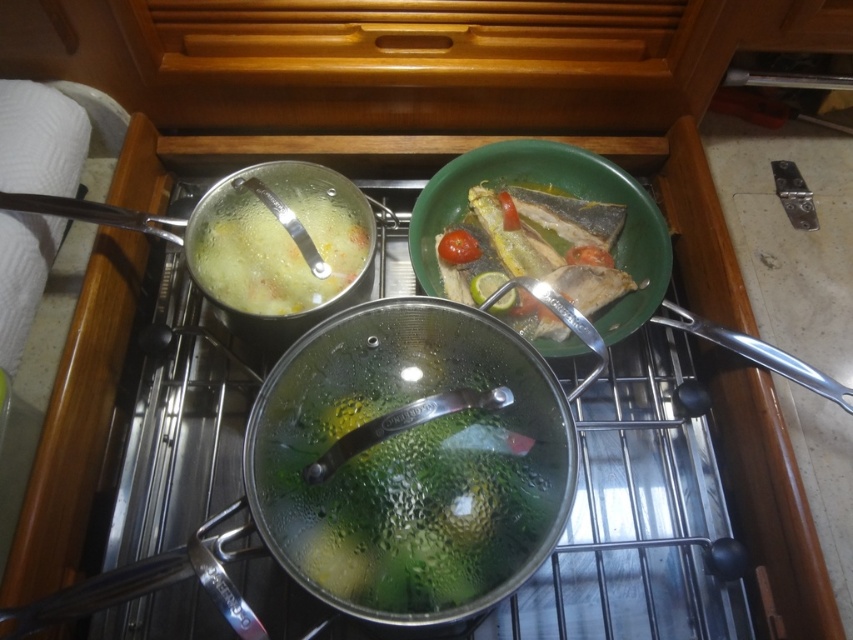
Question: Which of the following is the closest to the observer?

Choices:
 (A) green matte fish at center
 (B) translucent glass soup at upper left

Answer: (B)

Question: Which of the following is the farthest from the observer?

Choices:
 (A) green matte fish at center
 (B) translucent glass soup at upper left

Answer: (A)

Question: Does green matte fish at center lie in front of translucent glass soup at upper left?

Choices:
 (A) yes
 (B) no

Answer: (B)

Question: Which of the following is the closest to the observer?

Choices:
 (A) (605, 296)
 (B) (294, 260)

Answer: (B)

Question: Does green matte fish at center appear over translucent glass soup at upper left?

Choices:
 (A) yes
 (B) no

Answer: (B)

Question: Can you confirm if green matte fish at center is positioned to the right of translucent glass soup at upper left?

Choices:
 (A) no
 (B) yes

Answer: (B)